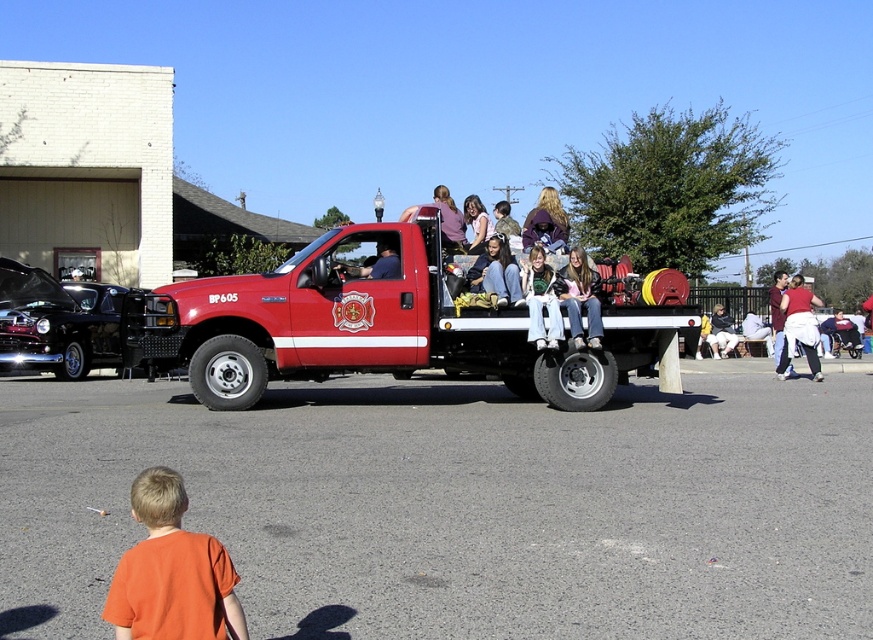
Who is lower down, matte pink shirt at center or matte white shirt at center?

matte white shirt at center is lower down.

Which is in front, point (597, 276) or point (810, 298)?

Point (597, 276)

What do you see at coordinates (581, 298) in the screenshot? I see `matte pink shirt at center` at bounding box center [581, 298].

The image size is (873, 640). I want to click on matte pink shirt at center, so click(x=581, y=298).

Is gray asphalt parking lot at lower center thinner than matte pink shirt at center?

No, gray asphalt parking lot at lower center is not thinner than matte pink shirt at center.

Does point (88, 468) come closer to viewer compared to point (579, 340)?

Yes, it is.

Who is more forward, (399, 557) or (558, 285)?

Point (399, 557) is in front.

What are the coordinates of `gray asphalt parking lot at lower center` in the screenshot? It's located at tap(458, 506).

Does shiny black car at left appear on the right side of matte white shirt at center?

In fact, shiny black car at left is to the left of matte white shirt at center.

Between shiny black car at left and matte white shirt at center, which one is positioned higher?

shiny black car at left is above.

Between point (4, 289) and point (805, 324), which one is positioned in front?

Positioned in front is point (805, 324).

The image size is (873, 640). Identify the location of shiny black car at left. (56, 323).